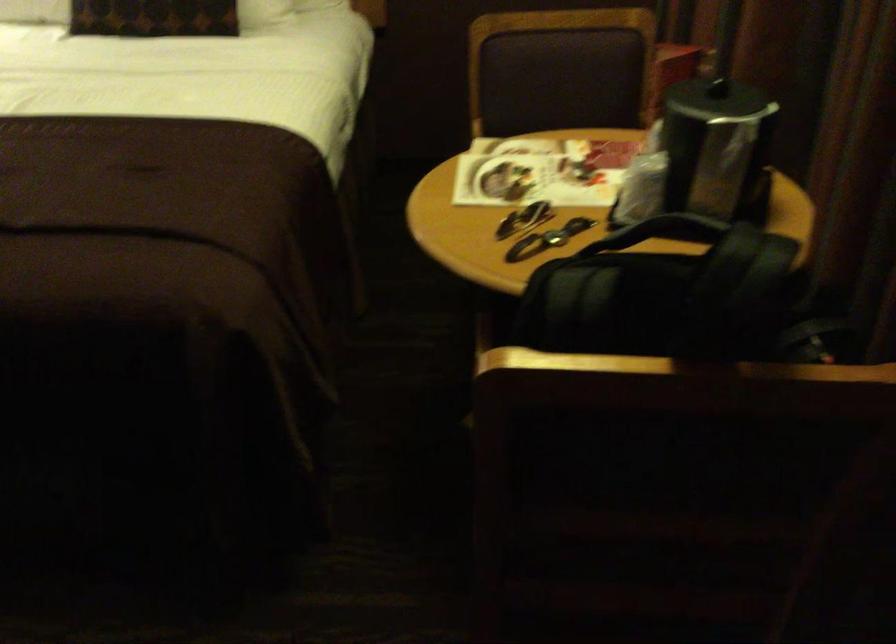
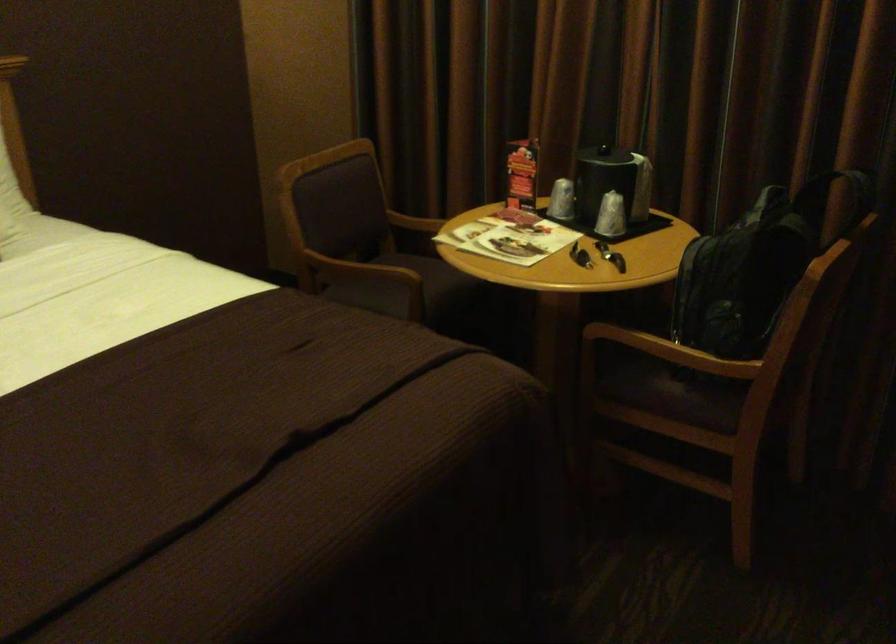
Locate, in the second image, the point that corresponds to the point at 546,219 in the first image.

(580, 254)